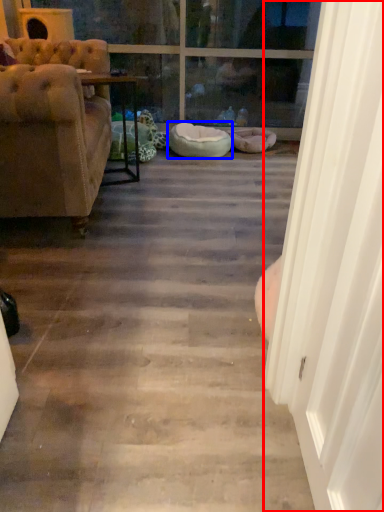
Question: Which of the following is the closest to the observer, screen door (highlighted by a red box) or dog bed (highlighted by a blue box)?

Choices:
 (A) screen door
 (B) dog bed

Answer: (A)